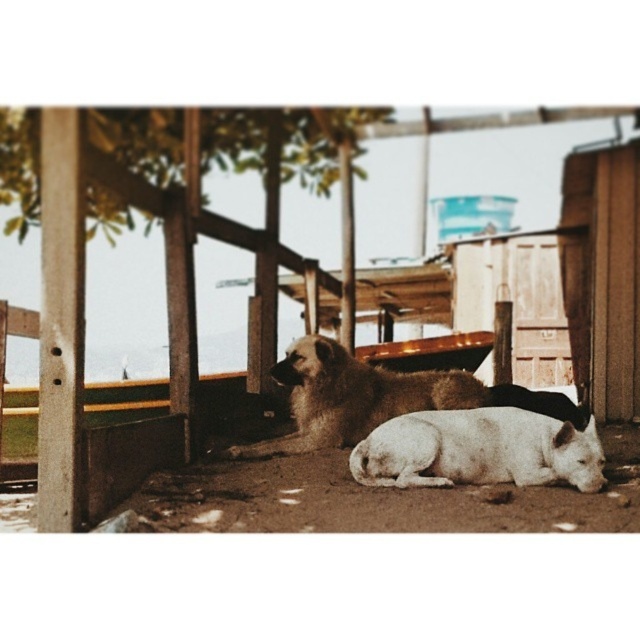
You are a photographer trying to capture both the brown wooden dogs at center and the white smooth dog at lower center in a single shot. Which dog should you focus on first to ensure both are in frame?

You should focus on the white smooth dog at lower center first because the brown wooden dogs at center is located above it, ensuring both will be captured when centered on the lower dog.

You are a photographer trying to capture both dogs in the scene. Since the brown wooden dogs at center and the brown fur dog at center are at the center, which one might appear smaller in your photo?

The brown wooden dogs at center has a lesser height compared to the brown fur dog at center, so it would appear smaller in the photo.

You are standing at the entrance of the wooden structure and want to throw a ball to both the brown wooden dogs at center and the white smooth dog at lower center. Which dog will the ball reach first if you throw it with the same force and angle?

The ball will reach the white smooth dog at lower center first because it is closer to you than the brown wooden dogs at center, which is farther away.